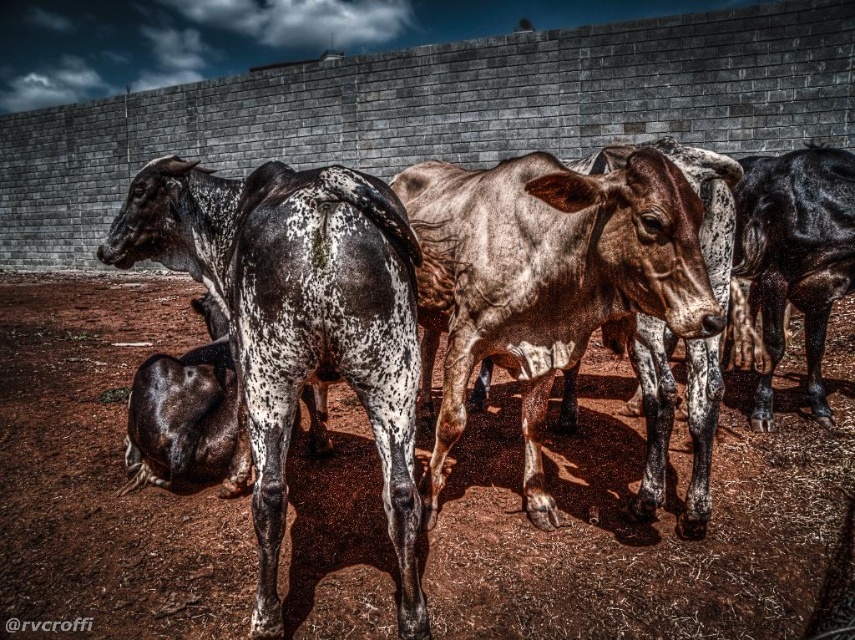
Question: Which object is positioned farthest from the speckled fur bull at center?

Choices:
 (A) speckled fur at center
 (B) brown dirt field at center
 (C) black glossy bull at right

Answer: (C)

Question: Is brown dirt field at center closer to camera compared to speckled fur at center?

Choices:
 (A) yes
 (B) no

Answer: (B)

Question: Based on their relative distances, which object is farther from the black glossy bull at right?

Choices:
 (A) speckled fur bull at center
 (B) brown dirt field at center

Answer: (A)

Question: Which point is farther from the camera taking this photo?

Choices:
 (A) (581, 216)
 (B) (429, 557)
 (C) (272, 228)
 (D) (821, 204)

Answer: (D)

Question: Observing the image, what is the correct spatial positioning of speckled fur bull at center in reference to speckled fur at center?

Choices:
 (A) left
 (B) right

Answer: (A)

Question: Observing the image, what is the correct spatial positioning of speckled fur at center in reference to black glossy bull at right?

Choices:
 (A) above
 (B) below

Answer: (B)